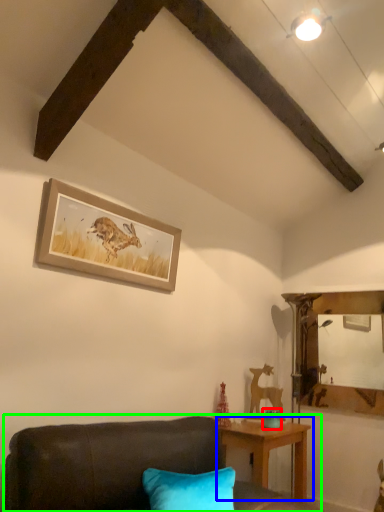
Question: Which is nearer to the teal (highlighted by a red box)? table (highlighted by a blue box) or studio couch (highlighted by a green box).

Choices:
 (A) table
 (B) studio couch

Answer: (A)